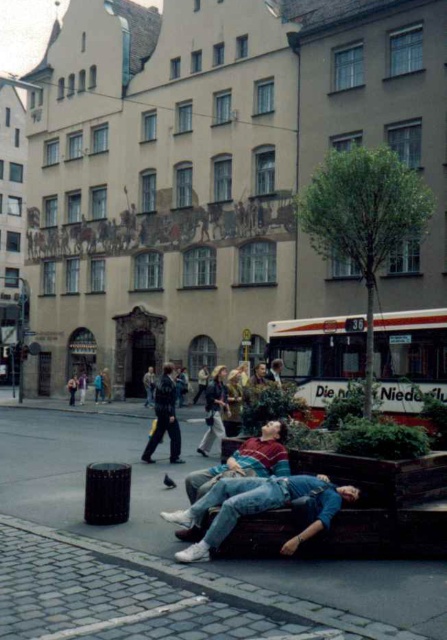
Can you confirm if denim jeans at lower center is shorter than matte red shirt at center?

Yes, denim jeans at lower center is shorter than matte red shirt at center.

Is denim jeans at lower center wider than matte red shirt at center?

Yes, denim jeans at lower center is wider than matte red shirt at center.

Who is more distant from viewer, (253,512) or (265,428)?

Point (265,428)

Locate an element on the screen. denim jeans at lower center is located at coordinates (258, 508).

Does brown wooden bench at lower center appear on the right side of denim jacket at center?

Yes, brown wooden bench at lower center is to the right of denim jacket at center.

Is point (336, 627) behind point (167, 406)?

That is False.

Identify the location of brown wooden bench at lower center. (168, 557).

What are the coordinates of `brown wooden bench at lower center` in the screenshot? It's located at (168, 557).

Which is above, brown wooden bench at lower center or denim jeans at lower center?

denim jeans at lower center

Measure the distance between brown wooden bench at lower center and camera.

brown wooden bench at lower center and camera are 5.05 meters apart from each other.

This screenshot has width=447, height=640. What are the coordinates of `brown wooden bench at lower center` in the screenshot? It's located at (168, 557).